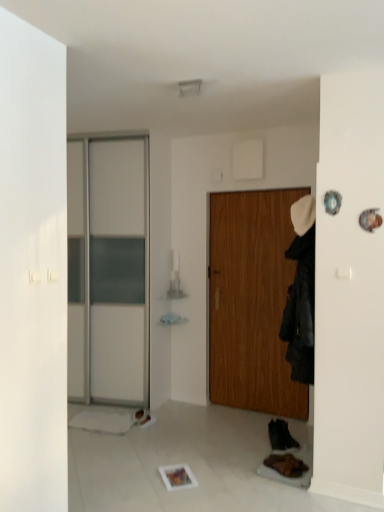
This screenshot has height=512, width=384. What are the coordinates of `black leather shoe at lower right, the 1th shoe from the right` in the screenshot? It's located at (280, 435).

You are a GUI agent. You are given a task and a screenshot of the screen. Output one action in this format:
    pyautogui.click(x=<x>, y=<y>)
    Task: Click on the black fabric coat at right
    The image size is (384, 512).
    Given the screenshot: What is the action you would take?
    pyautogui.click(x=300, y=309)

This screenshot has width=384, height=512. I want to click on brown suede shoe at lower right, marked as the third shoe in a back-to-front arrangement, so click(x=286, y=465).

This screenshot has height=512, width=384. In order to click on white leather shoe at lower center, the 3th shoe positioned from the front in this screenshot , I will do `click(145, 420)`.

Would you say white leather shoe at lower center, which ranks as the 1th shoe in back-to-front order, is part of wooden door at center's contents?

No, white leather shoe at lower center, which ranks as the 1th shoe in back-to-front order, is located outside of wooden door at center.

From a real-world perspective, is wooden door at center above or below white leather shoe at lower center, which ranks as the 1th shoe in back-to-front order?

In terms of real-world spatial position, wooden door at center is above white leather shoe at lower center, which ranks as the 1th shoe in back-to-front order.

I want to click on door that appears above the white leather shoe at lower center, the third shoe when ordered from right to left (from a real-world perspective), so click(252, 302).

From the image's perspective, is wooden door at center above or below white leather shoe at lower center, the third shoe when ordered from right to left?

Clearly, from the image's perspective, wooden door at center is above white leather shoe at lower center, the third shoe when ordered from right to left.

Based on the photo, considering the sizes of objects wooden door at center and black fabric coat at right in the image provided, who is thinner, wooden door at center or black fabric coat at right?

With smaller width is wooden door at center.

Between wooden door at center and black fabric coat at right, which one appears on the right side from the viewer's perspective?

From the viewer's perspective, black fabric coat at right appears more on the right side.

Considering the relative sizes of wooden door at center and black fabric coat at right in the image provided, is wooden door at center shorter than black fabric coat at right?

No.

Is wooden door at center outside of black fabric coat at right?

Yes, wooden door at center is not within black fabric coat at right.

Between brown suede shoe at lower right, which ranks as the 2th shoe in right-to-left order, and black leather shoe at lower right, the 1th shoe from the right, which one has larger width?

brown suede shoe at lower right, which ranks as the 2th shoe in right-to-left order, is wider.

Consider the image. From the image's perspective, is brown suede shoe at lower right, placed as the 1th shoe when sorted from front to back, under black leather shoe at lower right, which ranks as the 2th shoe in front-to-back order?

Yes.

Which is farther from the camera, (279, 460) or (278, 445)?

Point (278, 445)

Which object is positioned more to the right, brown suede shoe at lower right, placed as the 1th shoe when sorted from front to back, or black leather shoe at lower right, the 1th shoe from the right?

From the viewer's perspective, black leather shoe at lower right, the 1th shoe from the right, appears more on the right side.

Is brown suede shoe at lower right, marked as the third shoe in a back-to-front arrangement, in front of or behind black fabric coat at right in the image?

In the image, brown suede shoe at lower right, marked as the third shoe in a back-to-front arrangement, appears behind black fabric coat at right.

Is brown suede shoe at lower right, which ranks as the 2th shoe in right-to-left order, thinner than black fabric coat at right?

In fact, brown suede shoe at lower right, which ranks as the 2th shoe in right-to-left order, might be wider than black fabric coat at right.

Is there a large distance between brown suede shoe at lower right, placed as the 1th shoe when sorted from front to back, and black fabric coat at right?

No, there isn't a large distance between brown suede shoe at lower right, placed as the 1th shoe when sorted from front to back, and black fabric coat at right.

In the scene shown: From a real-world perspective, which is physically above, brown suede shoe at lower right, placed as the 1th shoe when sorted from front to back, or black fabric coat at right?

black fabric coat at right.

From the image's perspective, does wooden door at center appear lower than black leather shoe at lower right, which ranks as the 2th shoe in front-to-back order?

Incorrect, from the image's perspective, wooden door at center is higher than black leather shoe at lower right, which ranks as the 2th shoe in front-to-back order.

In terms of height, does wooden door at center look taller or shorter compared to black leather shoe at lower right, which appears as the 3th shoe when viewed from the left?

In the image, wooden door at center appears to be taller than black leather shoe at lower right, which appears as the 3th shoe when viewed from the left.

From a real-world perspective, relative to black leather shoe at lower right, arranged as the second shoe when viewed from the back, is wooden door at center vertically above or below?

From a real-world perspective, wooden door at center is physically above black leather shoe at lower right, arranged as the second shoe when viewed from the back.

Relative to black leather shoe at lower right, which appears as the 3th shoe when viewed from the left, is wooden door at center in front or behind?

wooden door at center is behind black leather shoe at lower right, which appears as the 3th shoe when viewed from the left.

Looking at their sizes, would you say wooden door at center is wider or thinner than brown suede shoe at lower right, which ranks as the 2th shoe in right-to-left order?

wooden door at center is thinner than brown suede shoe at lower right, which ranks as the 2th shoe in right-to-left order.

Does wooden door at center have a larger size compared to brown suede shoe at lower right, which ranks as the 2th shoe in right-to-left order?

Yes, wooden door at center is bigger than brown suede shoe at lower right, which ranks as the 2th shoe in right-to-left order.

From the image's perspective, does wooden door at center appear higher than brown suede shoe at lower right, marked as the third shoe in a back-to-front arrangement?

Yes, from the image's perspective, wooden door at center is on top of brown suede shoe at lower right, marked as the third shoe in a back-to-front arrangement.

Is black leather shoe at lower right, arranged as the second shoe when viewed from the back, oriented towards brown suede shoe at lower right, the 2th shoe from the left?

No, black leather shoe at lower right, arranged as the second shoe when viewed from the back, is not facing towards brown suede shoe at lower right, the 2th shoe from the left.

Is black leather shoe at lower right, arranged as the second shoe when viewed from the back, not near brown suede shoe at lower right, placed as the 1th shoe when sorted from front to back?

No, black leather shoe at lower right, arranged as the second shoe when viewed from the back, is in close proximity to brown suede shoe at lower right, placed as the 1th shoe when sorted from front to back.

Which object is closer to the camera, black leather shoe at lower right, which appears as the 3th shoe when viewed from the left, or brown suede shoe at lower right, marked as the third shoe in a back-to-front arrangement?

brown suede shoe at lower right, marked as the third shoe in a back-to-front arrangement.

Considering the positions of objects black leather shoe at lower right, which appears as the 3th shoe when viewed from the left, and brown suede shoe at lower right, placed as the 1th shoe when sorted from front to back, in the image provided, who is more to the left, black leather shoe at lower right, which appears as the 3th shoe when viewed from the left, or brown suede shoe at lower right, placed as the 1th shoe when sorted from front to back,?

Positioned to the left is brown suede shoe at lower right, placed as the 1th shoe when sorted from front to back.

Locate an element on the screen. This screenshot has width=384, height=512. door above the white leather shoe at lower center, the 3th shoe positioned from the front (from the image's perspective) is located at coordinates (252, 302).

Where is `door on the left of black fabric coat at right`? door on the left of black fabric coat at right is located at coordinates (252, 302).

When comparing their distances from brown suede shoe at lower right, marked as the third shoe in a back-to-front arrangement, does black leather shoe at lower right, arranged as the second shoe when viewed from the back, or wooden door at center seem closer?

Based on the image, black leather shoe at lower right, arranged as the second shoe when viewed from the back, appears to be nearer to brown suede shoe at lower right, marked as the third shoe in a back-to-front arrangement.

Estimate the real-world distances between objects in this image. Which object is closer to black leather shoe at lower right, which appears as the 3th shoe when viewed from the left, white leather shoe at lower center, which ranks as the 1th shoe in back-to-front order, or wooden door at center?

The object closer to black leather shoe at lower right, which appears as the 3th shoe when viewed from the left, is wooden door at center.

Estimate the real-world distances between objects in this image. Which object is closer to brown suede shoe at lower right, the 2th shoe from the left, wooden door at center or white leather shoe at lower center, which ranks as the 1th shoe in left-to-right order?

white leather shoe at lower center, which ranks as the 1th shoe in left-to-right order.

Considering their positions, is brown suede shoe at lower right, the 2th shoe from the left, positioned closer to black leather shoe at lower right, the 1th shoe from the right, than white leather shoe at lower center, which ranks as the 1th shoe in left-to-right order?

brown suede shoe at lower right, the 2th shoe from the left, lies closer to black leather shoe at lower right, the 1th shoe from the right, than the other object.

When comparing their distances from black fabric coat at right, does wooden door at center or brown suede shoe at lower right, which ranks as the 2th shoe in right-to-left order, seem closer?

Based on the image, wooden door at center appears to be nearer to black fabric coat at right.

Based on their spatial positions, is wooden door at center or black fabric coat at right further from white leather shoe at lower center, the third shoe when ordered from right to left?

black fabric coat at right is positioned further to the anchor white leather shoe at lower center, the third shoe when ordered from right to left.

Looking at the image, which one is located closer to black leather shoe at lower right, which ranks as the 2th shoe in front-to-back order, white leather shoe at lower center, the third shoe when ordered from right to left, or black fabric coat at right?

black fabric coat at right is closer to black leather shoe at lower right, which ranks as the 2th shoe in front-to-back order.

Looking at the image, which one is located further to black fabric coat at right, black leather shoe at lower right, the 1th shoe from the right, or wooden door at center?

black leather shoe at lower right, the 1th shoe from the right, lies further to black fabric coat at right than the other object.

The height and width of the screenshot is (512, 384). In order to click on door that lies between black fabric coat at right and black leather shoe at lower right, arranged as the second shoe when viewed from the back, from top to bottom in this screenshot , I will do `click(252, 302)`.

Where is `clothing between white leather shoe at lower center, the third shoe when ordered from right to left, and black leather shoe at lower right, which appears as the 3th shoe when viewed from the left, in the horizontal direction`? This screenshot has width=384, height=512. clothing between white leather shoe at lower center, the third shoe when ordered from right to left, and black leather shoe at lower right, which appears as the 3th shoe when viewed from the left, in the horizontal direction is located at coordinates (300, 309).

At what (x,y) coordinates should I click in order to perform the action: click on door between black fabric coat at right and brown suede shoe at lower right, which ranks as the 2th shoe in right-to-left order, from top to bottom. Please return your answer as a coordinate pair (x, y). The height and width of the screenshot is (512, 384). Looking at the image, I should click on click(252, 302).

Where is `door between black fabric coat at right and white leather shoe at lower center, the third shoe when ordered from right to left, in the up-down direction`? door between black fabric coat at right and white leather shoe at lower center, the third shoe when ordered from right to left, in the up-down direction is located at coordinates (252, 302).